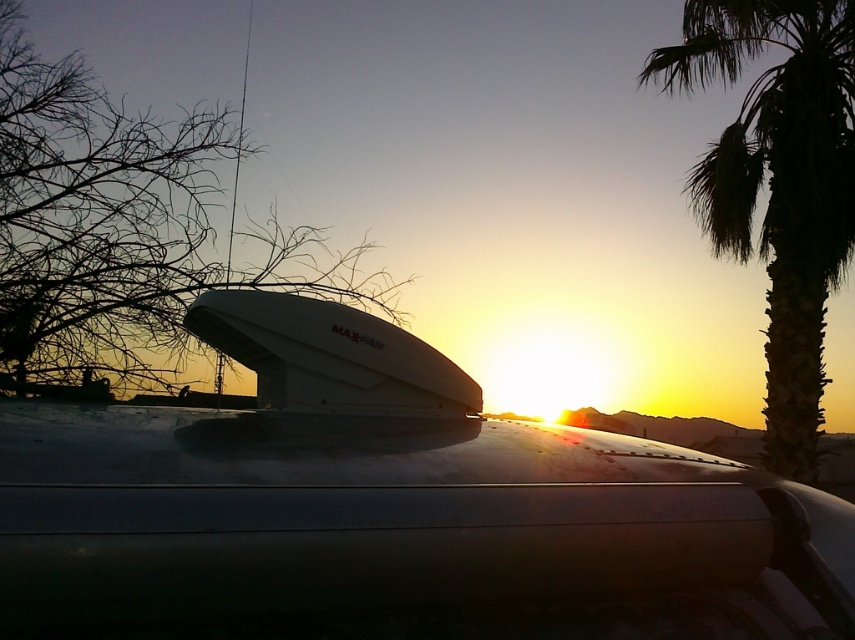
You are a photographer trying to capture the sunset. You notice the bare branches at upper left and the green leafy palm tree at right in your frame. Which object is wider in the image?

The bare branches at upper left might be wider than green leafy palm tree at right according to the description.

Based on the photo, you are a photographer trying to capture the sunset scene. You notice the bare branches at upper left and the green leafy palm tree at right in your viewfinder. Which object will appear smaller in your photo?

The bare branches at upper left will appear smaller in the photo because it is smaller than the green leafy palm tree at right.

You are standing in the scene and want to take a photo of the sunset with the bare branches at upper left in the frame. Where should you position yourself relative to the vehicle to ensure the branches are visible?

You should position yourself to the right side of the vehicle so that the bare branches at upper left can be captured in the photo frame.